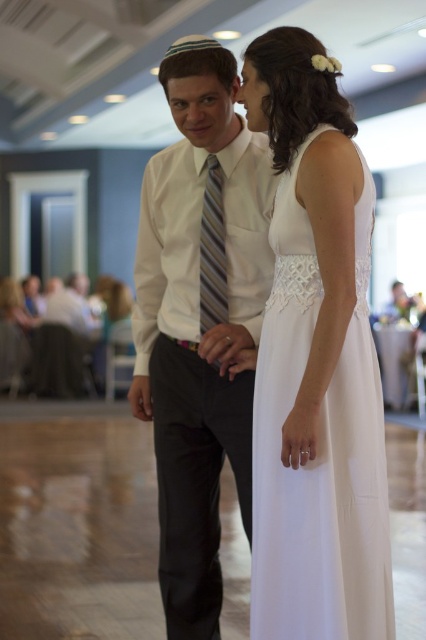
Question: Which of the following is the closest to the observer?

Choices:
 (A) white lace dress at center
 (B) striped fabric tie at center

Answer: (A)

Question: Can you confirm if white satin shirt at center is thinner than white lace dress at center?

Choices:
 (A) no
 (B) yes

Answer: (A)

Question: Which point is closer to the camera taking this photo?

Choices:
 (A) (365, 568)
 (B) (218, 285)
 (C) (196, 93)

Answer: (A)

Question: Does striped fabric tie at center appear over matte white forehead at upper center?

Choices:
 (A) no
 (B) yes

Answer: (A)

Question: Which point appears farthest from the camera in this image?

Choices:
 (A) (362, 208)
 (B) (264, 250)
 (C) (198, 81)
 (D) (207, 294)

Answer: (D)

Question: Does white satin shirt at center come in front of striped fabric tie at center?

Choices:
 (A) no
 (B) yes

Answer: (B)